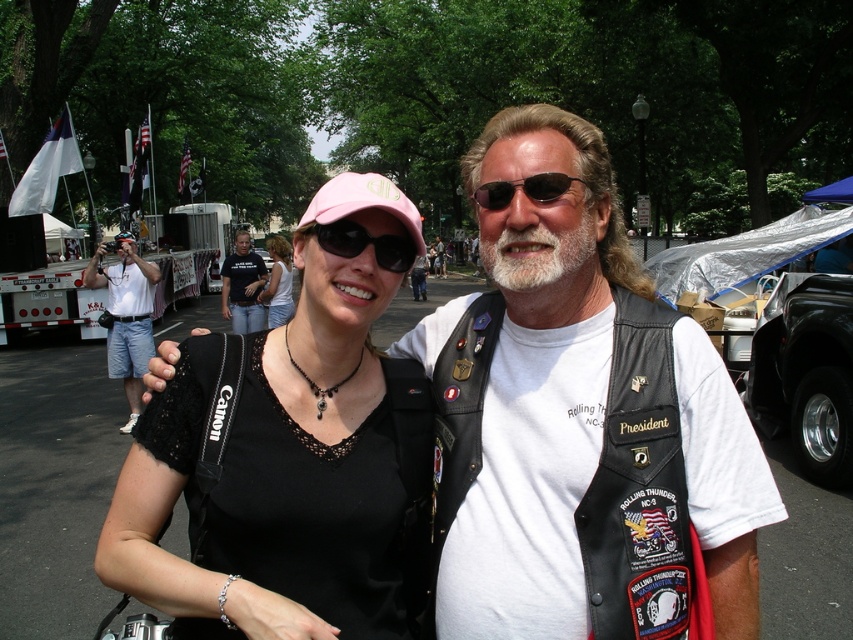
Who is shorter, white cotton t-shirt at left or whitehairbeard at center?

Standing shorter between the two is whitehairbeard at center.

Is white cotton t-shirt at left shorter than whitehairbeard at center?

Incorrect, white cotton t-shirt at left's height does not fall short of whitehairbeard at center's.

Identify the location of white cotton t-shirt at left. Image resolution: width=853 pixels, height=640 pixels. (126, 316).

The width and height of the screenshot is (853, 640). I want to click on white cotton t-shirt at left, so click(126, 316).

Which is below, white cotton t-shirt at left or matte black cap at center?

Positioned lower is white cotton t-shirt at left.

Does white cotton t-shirt at left have a greater width compared to matte black cap at center?

In fact, white cotton t-shirt at left might be narrower than matte black cap at center.

Where is `white cotton t-shirt at left`? This screenshot has height=640, width=853. white cotton t-shirt at left is located at coordinates tap(126, 316).

You are a GUI agent. You are given a task and a screenshot of the screen. Output one action in this format:
    pyautogui.click(x=<x>, y=<y>)
    Task: Click on the white cotton t-shirt at left
    The height and width of the screenshot is (640, 853).
    Given the screenshot: What is the action you would take?
    pyautogui.click(x=126, y=316)

Between black cotton t-shirt at center and sunglasses at center, which one appears on the right side from the viewer's perspective?

sunglasses at center

Can you confirm if black cotton t-shirt at center is positioned above sunglasses at center?

Correct, black cotton t-shirt at center is located above sunglasses at center.

Identify the location of black cotton t-shirt at center. The width and height of the screenshot is (853, 640). (242, 285).